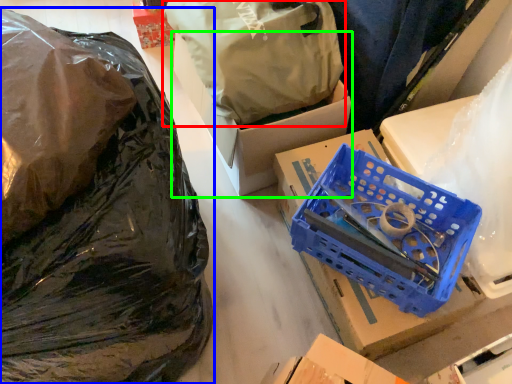
Question: Which object is positioned closest to plastic bag (highlighted by a red box)? Select from plastic bag (highlighted by a blue box) and box (highlighted by a green box).

Choices:
 (A) plastic bag
 (B) box

Answer: (B)